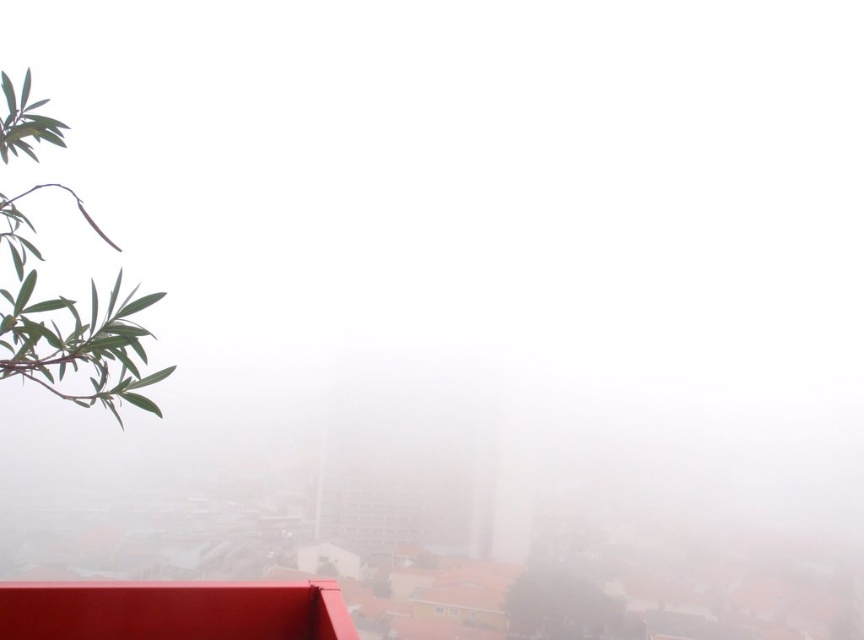
Who is taller, green leafy branch at upper left or green leafy olive tree at lower left?

Standing taller between the two is green leafy olive tree at lower left.

Does point (0, 301) come farther from viewer compared to point (522, 602)?

No, (0, 301) is in front of (522, 602).

The width and height of the screenshot is (864, 640). In order to click on green leafy branch at upper left in this screenshot , I will do `click(70, 324)`.